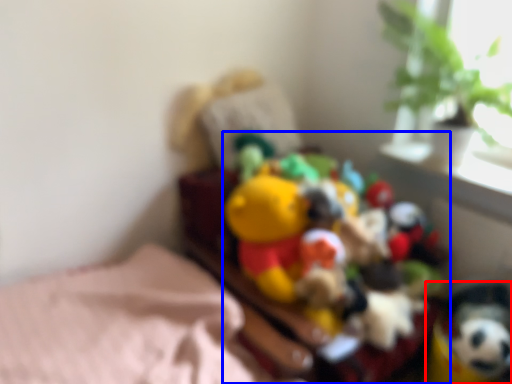
Question: Which of the following is the closest to the observer, toy (highlighted by a red box) or toy (highlighted by a blue box)?

Choices:
 (A) toy
 (B) toy

Answer: (B)